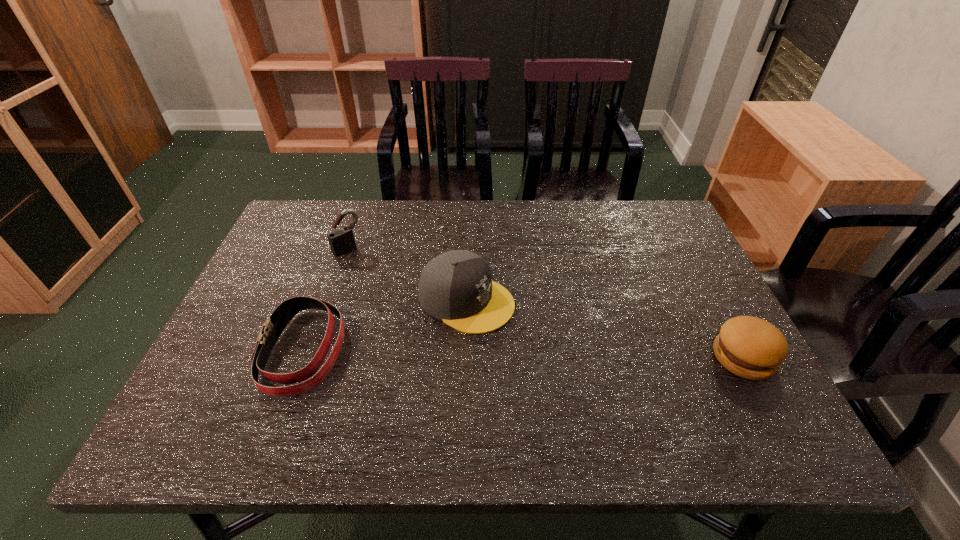
Where is `free space at the near edge`? The width and height of the screenshot is (960, 540). free space at the near edge is located at coordinates (337, 374).

Where is `free region at the left edge of the desktop`? The image size is (960, 540). free region at the left edge of the desktop is located at coordinates (254, 292).

The width and height of the screenshot is (960, 540). What are the coordinates of `free point at the right edge` in the screenshot? It's located at (649, 250).

In the image, there is a desktop. Where is `free space at the far left corner`? This screenshot has height=540, width=960. free space at the far left corner is located at coordinates (274, 244).

Identify the location of free space at the near left corner of the desktop. The image size is (960, 540). (218, 386).

Image resolution: width=960 pixels, height=540 pixels. I want to click on unoccupied position between the dog collar and the hamburger, so (x=523, y=354).

Image resolution: width=960 pixels, height=540 pixels. Identify the location of free space that is in between the padlock and the hamburger. (545, 303).

Where is `free spot between the farthest object and the hamburger`? The width and height of the screenshot is (960, 540). free spot between the farthest object and the hamburger is located at coordinates (545, 303).

The width and height of the screenshot is (960, 540). I want to click on blank region between the farthest object and the dog collar, so click(325, 299).

Find the location of `vacant area between the dog collar and the farthest object`. vacant area between the dog collar and the farthest object is located at coordinates (325, 299).